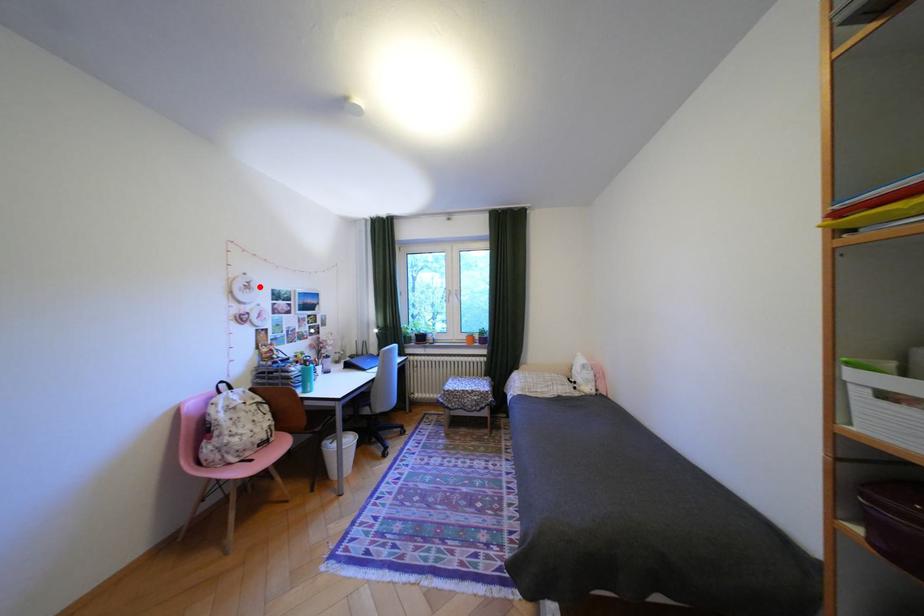
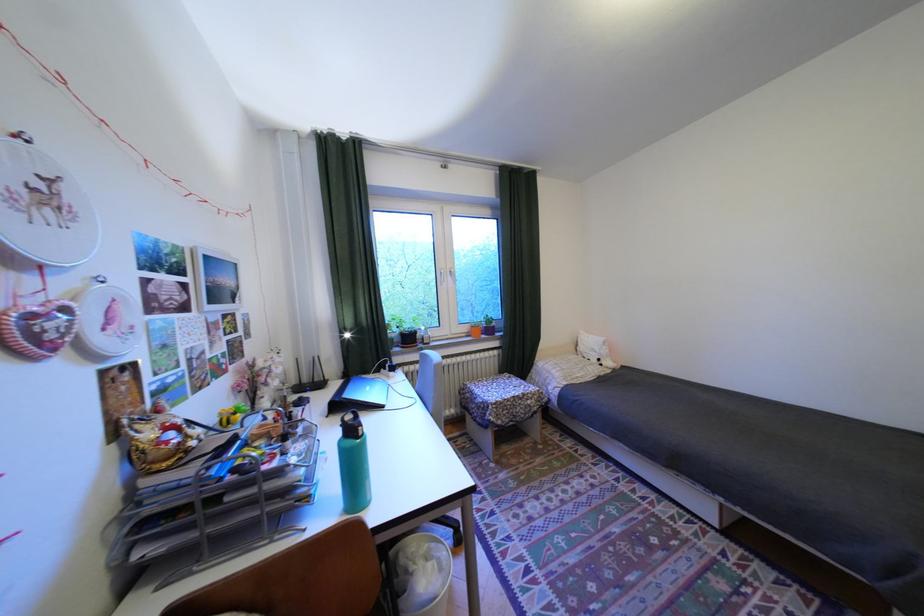
Where in the second image is the point corresponding to the highlighted location from the first image?

(58, 197)